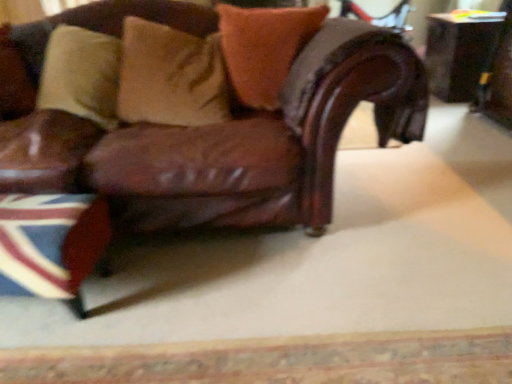
What are the coordinates of `unoccupied region to the right of union jack fabric at lower left` in the screenshot? It's located at (144, 294).